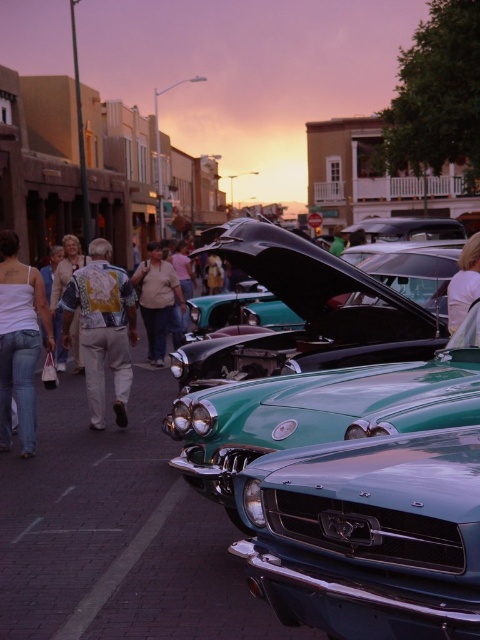
Does light brown leather jacket at center have a lesser width compared to light brown hair at center?

No.

Image resolution: width=480 pixels, height=640 pixels. Describe the element at coordinates (156, 300) in the screenshot. I see `light brown leather jacket at center` at that location.

Which is behind, point (141, 301) or point (467, 257)?

Point (141, 301)

At what (x,y) coordinates should I click in order to perform the action: click on light brown leather jacket at center. Please return your answer as a coordinate pair (x, y). Looking at the image, I should click on (156, 300).

Is printed fabric shirt at center to the left of white painted line at lower left from the viewer's perspective?

Indeed, printed fabric shirt at center is positioned on the left side of white painted line at lower left.

Between point (92, 320) and point (85, 628), which one is positioned behind?

Point (92, 320)

Find the location of a particular element. printed fabric shirt at center is located at coordinates (103, 328).

You are a GUI agent. You are given a task and a screenshot of the screen. Output one action in this format:
    pyautogui.click(x=<x>, y=<y>)
    Task: Click on the printed fabric shirt at center
    Image resolution: width=480 pixels, height=640 pixels.
    Given the screenshot: What is the action you would take?
    pyautogui.click(x=103, y=328)

This screenshot has width=480, height=640. What do you see at coordinates (20, 340) in the screenshot?
I see `white denim jeans at left` at bounding box center [20, 340].

Is white denim jeans at left shorter than light brown hair at center?

Incorrect, white denim jeans at left's height does not fall short of light brown hair at center's.

In order to click on white denim jeans at left in this screenshot , I will do `click(20, 340)`.